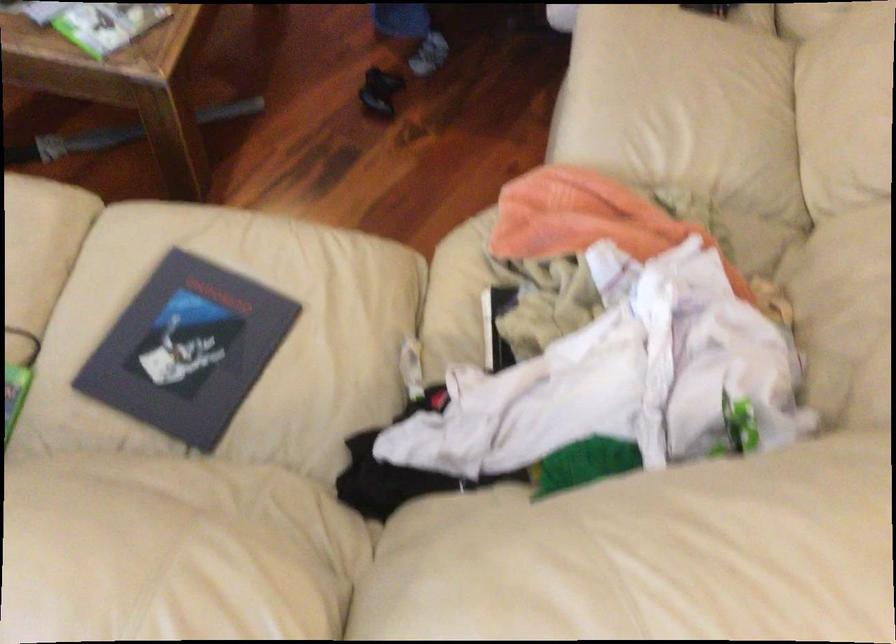
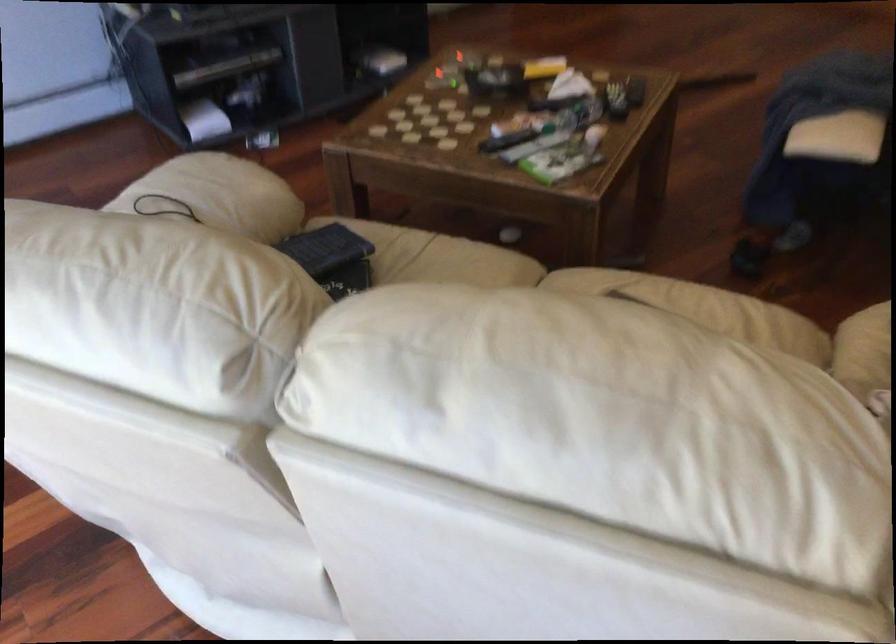
Find the pixel in the second image that matches the point at 139,251 in the first image.

(584, 285)